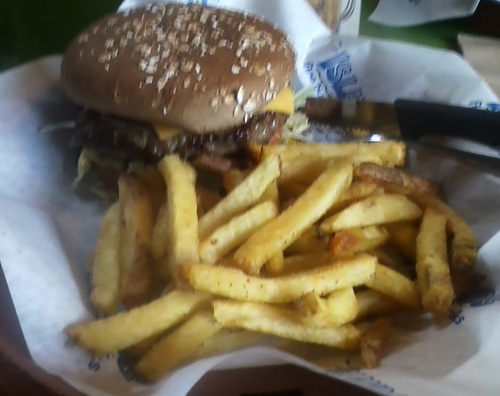
Where is `table`? table is located at coordinates (266, 378).